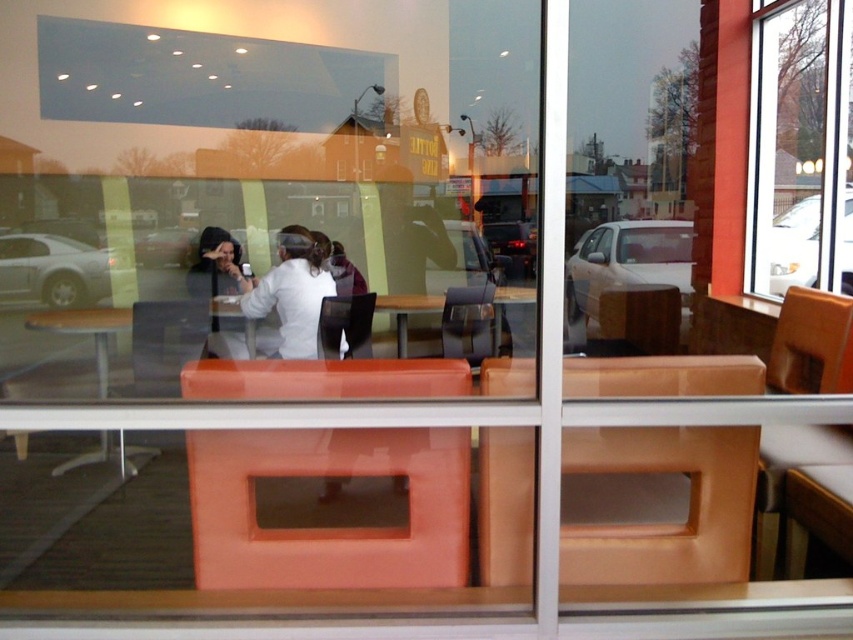
You are standing at the entrance of the dining establishment and looking through the large windows. You notice two points marked on the window glass. The first point is at coordinate point (x=769, y=273) and the second is at point (x=289, y=310). From your vantage point, which point is closer to you?

Point (x=289, y=310) is closer to you because the description states that point (x=769, y=273) is behind point (x=289, y=310), meaning the latter is in front and thus nearer.

You are a customer waiting to be seated. You notice the transparent glass window at upper right and the white matte shirt at center. Which object is closer to you as you stand facing the entrance?

The transparent glass window at upper right is closer to you than the white matte shirt at center, which is positioned behind it.

You are a delivery person standing at the entrance of the dining establishment. You need to place a large package that is 4 meters long on the floor near the transparent glass window at upper right. Considering the space between you and the window, is there enough room to maneuver the package to the window without hitting any obstacles?

The distance between the transparent glass window at upper right and the camera is 4.50 meters. Since the package is 4 meters long, there is sufficient space to maneuver it to the window without obstacles as the available space is longer than the package.